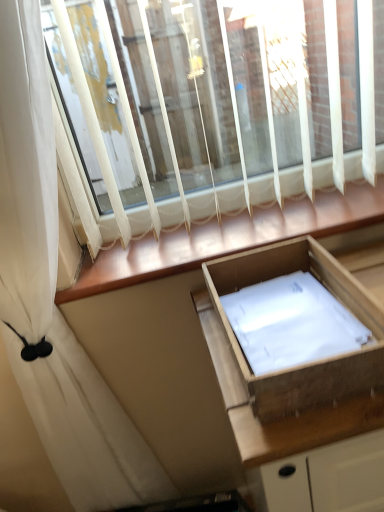
At what (x,y) coordinates should I click in order to perform the action: click on wooden drawer at center. Please return your answer as a coordinate pair (x, y). The image size is (384, 512). Looking at the image, I should click on (300, 438).

Identify the location of wooden at lower center. This screenshot has width=384, height=512. (227, 238).

Measure the distance between white sheer curtain at upper left and camera.

22.28 inches.

Where is `wooden drawer at center`? wooden drawer at center is located at coordinates (300, 438).

At what (x,y) coordinates should I click in order to perform the action: click on window sill located above the white sheer curtain at upper left (from a real-world perspective). Please return your answer as a coordinate pair (x, y). The image size is (384, 512). Looking at the image, I should click on (227, 238).

Is wooden at lower center bigger than white sheer curtain at upper left?

No.

Could you tell me if wooden at lower center is turned towards white sheer curtain at upper left?

No, wooden at lower center is not aimed at white sheer curtain at upper left.

Does wooden at lower center have a lesser width compared to white sheer curtain at upper left?

No.

Which is correct: wooden drawer at center is inside white sheer curtain at upper left, or outside of it?

wooden drawer at center is located beyond the bounds of white sheer curtain at upper left.

From the picture: Is wooden drawer at center taller or shorter than white sheer curtain at upper left?

In the image, wooden drawer at center appears to be shorter than white sheer curtain at upper left.

In the scene shown: Based on their sizes in the image, would you say wooden drawer at center is bigger or smaller than white sheer curtain at upper left?

wooden drawer at center is bigger than white sheer curtain at upper left.

How many degrees apart are the facing directions of wooden drawer at center and white sheer curtain at upper left?

They differ by 1.35 degrees in their facing directions.

In the scene shown: Which of these two, wooden drawer at center or wooden at lower center, stands taller?

wooden drawer at center is taller.

I want to click on cabinetry that appears below the wooden at lower center (from the image's perspective), so click(x=300, y=438).

Considering the positions of points (317, 405) and (138, 280), is point (317, 405) farther from camera compared to point (138, 280)?

No, (317, 405) is in front of (138, 280).

How distant is wooden drawer at center from wooden at lower center?

wooden drawer at center and wooden at lower center are 8.68 inches apart.

This screenshot has width=384, height=512. Find the location of `window sill behind the wooden drawer at center`. window sill behind the wooden drawer at center is located at coordinates (227, 238).

How much distance is there between wooden at lower center and wooden drawer at center?

A distance of 8.68 inches exists between wooden at lower center and wooden drawer at center.

From the picture: Would you say wooden at lower center is outside wooden drawer at center?

wooden at lower center lies outside wooden drawer at center's area.

Considering the sizes of white sheer curtain at upper left and wooden drawer at center in the image, is white sheer curtain at upper left wider or thinner than wooden drawer at center?

white sheer curtain at upper left is thinner than wooden drawer at center.

Where is `cabinetry below the white sheer curtain at upper left (from a real-world perspective)`? cabinetry below the white sheer curtain at upper left (from a real-world perspective) is located at coordinates (300, 438).

Is white sheer curtain at upper left bigger or smaller than wooden drawer at center?

In the image, white sheer curtain at upper left appears to be smaller than wooden drawer at center.

Which is in front, white sheer curtain at upper left or wooden drawer at center?

white sheer curtain at upper left is closer to the camera.

Which is less distant, (x=101, y=488) or (x=231, y=244)?

Point (x=101, y=488).

Which object is closer to the camera taking this photo, white sheer curtain at upper left or wooden at lower center?

Positioned in front is white sheer curtain at upper left.

Do you think white sheer curtain at upper left is within wooden at lower center, or outside of it?

white sheer curtain at upper left is spatially situated outside wooden at lower center.

Where is `curtain lying in front of the wooden at lower center`? curtain lying in front of the wooden at lower center is located at coordinates (54, 296).

Where is `curtain directly beneath the wooden at lower center (from a real-world perspective)`? The image size is (384, 512). curtain directly beneath the wooden at lower center (from a real-world perspective) is located at coordinates (54, 296).

At what (x,y) coordinates should I click in order to perform the action: click on cabinetry located on the right of white sheer curtain at upper left. Please return your answer as a coordinate pair (x, y). This screenshot has width=384, height=512. Looking at the image, I should click on (300, 438).

Considering their positions, is wooden at lower center positioned closer to wooden drawer at center than white sheer curtain at upper left?

wooden at lower center is positioned closer to the anchor wooden drawer at center.

Which object lies further to the anchor point wooden drawer at center, white sheer curtain at upper left or wooden at lower center?

Among the two, white sheer curtain at upper left is located further to wooden drawer at center.

Looking at the image, which one is located further to white sheer curtain at upper left, wooden drawer at center or wooden at lower center?

wooden drawer at center.

From the image, which object appears to be farther from wooden at lower center, wooden drawer at center or white sheer curtain at upper left?

The object further to wooden at lower center is white sheer curtain at upper left.

Considering their positions, is white sheer curtain at upper left positioned closer to wooden at lower center than wooden drawer at center?

Based on the image, wooden drawer at center appears to be nearer to wooden at lower center.

Estimate the real-world distances between objects in this image. Which object is closer to white sheer curtain at upper left, wooden at lower center or wooden drawer at center?

wooden at lower center is positioned closer to the anchor white sheer curtain at upper left.

At what (x,y) coordinates should I click in order to perform the action: click on curtain between wooden at lower center and wooden drawer at center in the up-down direction. Please return your answer as a coordinate pair (x, y). Looking at the image, I should click on (54, 296).